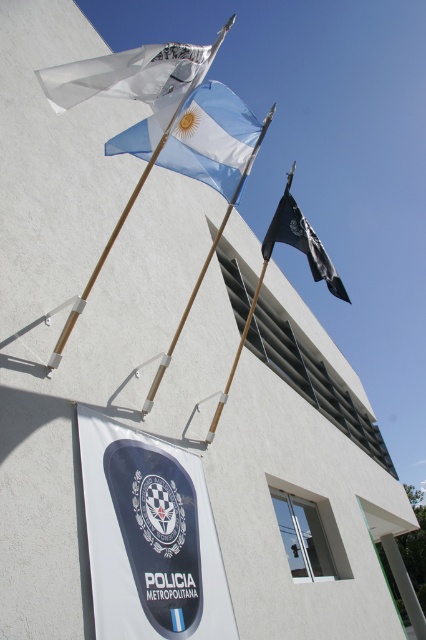
You are a visitor approaching the building and see the white matte banner at lower center and the white fabric flag at upper left. Which one is closer to the ground?

The white matte banner at lower center is positioned under the white fabric flag at upper left, so it is closer to the ground.

You are a visitor to the building and want to know which flag is larger between the white matte banner at lower center and the blue fabric flag at upper center. Can you tell me which one is bigger?

A: The blue fabric flag at upper center is bigger than the white matte banner at lower center because the white matte banner at lower center has a smaller size compared to blue fabric flag at upper center.